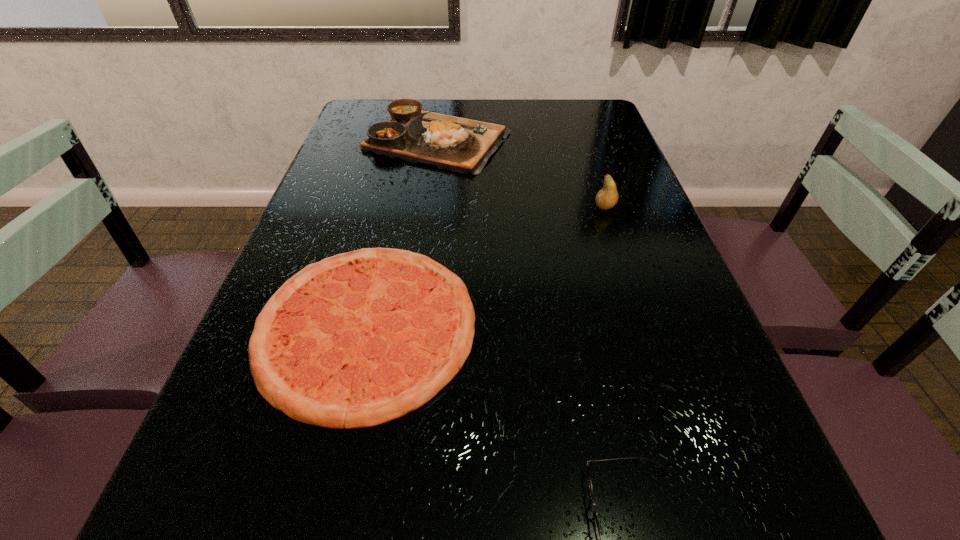
What are the coordinates of `the tallest object` in the screenshot? It's located at (607, 197).

The height and width of the screenshot is (540, 960). I want to click on the rightmost object, so click(x=607, y=197).

Where is `the farthest object`? Image resolution: width=960 pixels, height=540 pixels. the farthest object is located at coordinates tap(461, 145).

What are the coordinates of `platter` in the screenshot? It's located at (461, 145).

This screenshot has height=540, width=960. What are the coordinates of `pizza` in the screenshot? It's located at (361, 338).

Locate an element on the screen. This screenshot has width=960, height=540. blank space located on the right of the pear is located at coordinates [x=647, y=207].

What are the coordinates of `vacant space situated on the front of the farthest object` in the screenshot? It's located at (421, 229).

The image size is (960, 540). I want to click on vacant point located 0.160m on the back of the pizza, so click(394, 211).

Locate an element on the screen. This screenshot has width=960, height=540. object at the far edge is located at coordinates (461, 145).

Find the location of a particular element. The image size is (960, 540). platter that is at the left edge is located at coordinates (461, 145).